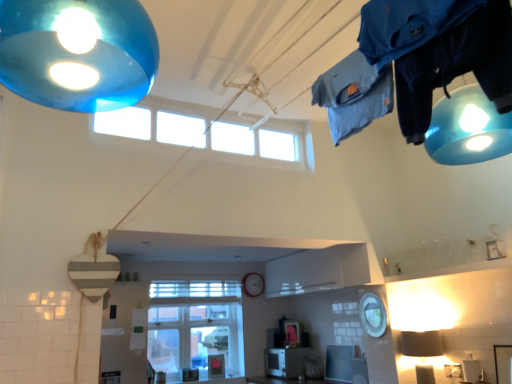
Question: From the image's perspective, does clear glass window at center, which is the 1th window in bottom-to-top order, appear higher than transparent glass window at upper center, which ranks as the second window in back-to-front order?

Choices:
 (A) yes
 (B) no

Answer: (B)

Question: Is clear glass window at center, the first window in the back-to-front sequence, shorter than transparent glass window at upper center, marked as the 1th window in a front-to-back arrangement?

Choices:
 (A) no
 (B) yes

Answer: (A)

Question: From a real-world perspective, is clear glass window at center, which is the 1th window in bottom-to-top order, on transparent glass window at upper center, acting as the second window starting from the bottom?

Choices:
 (A) no
 (B) yes

Answer: (A)

Question: Is clear glass window at center, placed as the second window when sorted from top to bottom, further to camera compared to transparent glass window at upper center, placed as the first window when sorted from top to bottom?

Choices:
 (A) yes
 (B) no

Answer: (A)

Question: Considering the relative sizes of clear glass window at center, which is the 1th window in bottom-to-top order, and transparent glass window at upper center, marked as the 1th window in a front-to-back arrangement, in the image provided, is clear glass window at center, which is the 1th window in bottom-to-top order, bigger than transparent glass window at upper center, marked as the 1th window in a front-to-back arrangement,?

Choices:
 (A) no
 (B) yes

Answer: (B)

Question: Considering the positions of point (432, 349) and point (260, 292), is point (432, 349) closer or farther from the camera than point (260, 292)?

Choices:
 (A) closer
 (B) farther

Answer: (A)

Question: Is matte white lampshade at lower right inside the boundaries of metallic silver clock at center, or outside?

Choices:
 (A) inside
 (B) outside

Answer: (B)

Question: From a real-world perspective, relative to metallic silver clock at center, is matte white lampshade at lower right vertically above or below?

Choices:
 (A) below
 (B) above

Answer: (A)

Question: Is matte white lampshade at lower right in front of or behind metallic silver clock at center in the image?

Choices:
 (A) behind
 (B) front

Answer: (B)

Question: Considering the positions of transparent glass window at upper center, placed as the first window when sorted from top to bottom, and matte white lampshade at lower right in the image, is transparent glass window at upper center, placed as the first window when sorted from top to bottom, wider or thinner than matte white lampshade at lower right?

Choices:
 (A) thin
 (B) wide

Answer: (A)

Question: From the image's perspective, is transparent glass window at upper center, placed as the first window when sorted from top to bottom, above or below matte white lampshade at lower right?

Choices:
 (A) below
 (B) above

Answer: (B)

Question: Do you think transparent glass window at upper center, placed as the first window when sorted from top to bottom, is within matte white lampshade at lower right, or outside of it?

Choices:
 (A) outside
 (B) inside

Answer: (A)

Question: From a real-world perspective, is transparent glass window at upper center, which ranks as the second window in back-to-front order, positioned above or below matte white lampshade at lower right?

Choices:
 (A) above
 (B) below

Answer: (A)

Question: From their relative heights in the image, would you say matte white lampshade at lower right is taller or shorter than clear glass window at center, placed as the second window when sorted from top to bottom?

Choices:
 (A) short
 (B) tall

Answer: (A)

Question: Based on their sizes in the image, would you say matte white lampshade at lower right is bigger or smaller than clear glass window at center, placed as the second window when sorted from top to bottom?

Choices:
 (A) big
 (B) small

Answer: (B)